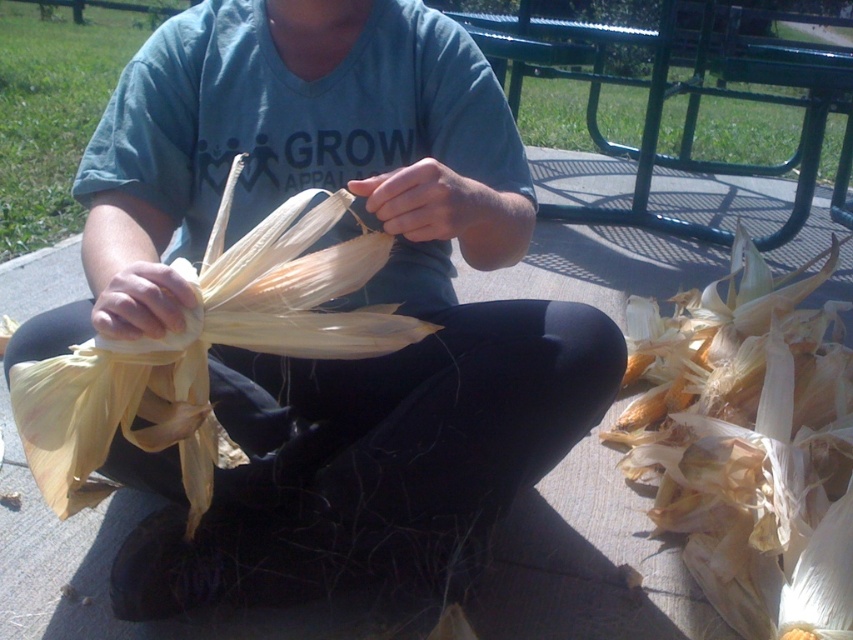
Question: Considering the real-world distances, which object is farthest from the yellow papery corn husks at lower right?

Choices:
 (A) yellow papery corn at center
 (B) matte yellow corn husk at center

Answer: (A)

Question: Which object is the closest to the matte yellow corn husk at center?

Choices:
 (A) yellow papery corn at center
 (B) yellow papery corn husks at lower right

Answer: (A)

Question: Does yellow papery corn husks at lower right appear over yellow papery corn at center?

Choices:
 (A) no
 (B) yes

Answer: (A)

Question: Which point is farther from the camera taking this photo?

Choices:
 (A) (260, 467)
 (B) (828, 250)

Answer: (B)

Question: Is matte yellow corn husk at center to the right of yellow papery corn husks at lower right from the viewer's perspective?

Choices:
 (A) no
 (B) yes

Answer: (A)

Question: Can you confirm if matte yellow corn husk at center is smaller than yellow papery corn husks at lower right?

Choices:
 (A) no
 (B) yes

Answer: (B)